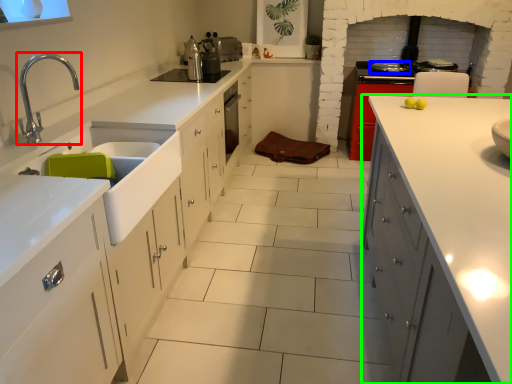
Question: Considering the real-world distances, which object is farthest from tap (highlighted by a red box)? kitchen appliance (highlighted by a blue box) or cabinetry (highlighted by a green box)?

Choices:
 (A) kitchen appliance
 (B) cabinetry

Answer: (A)